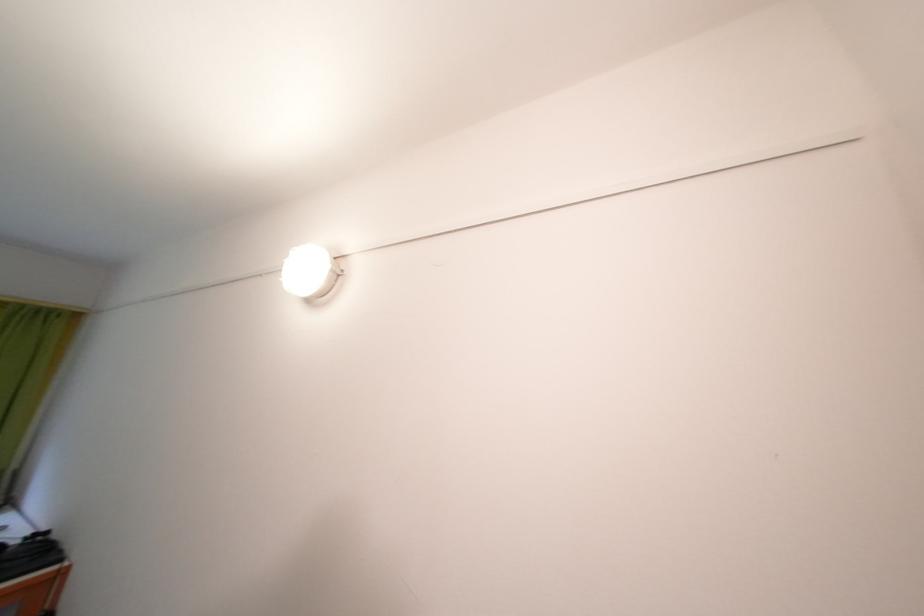
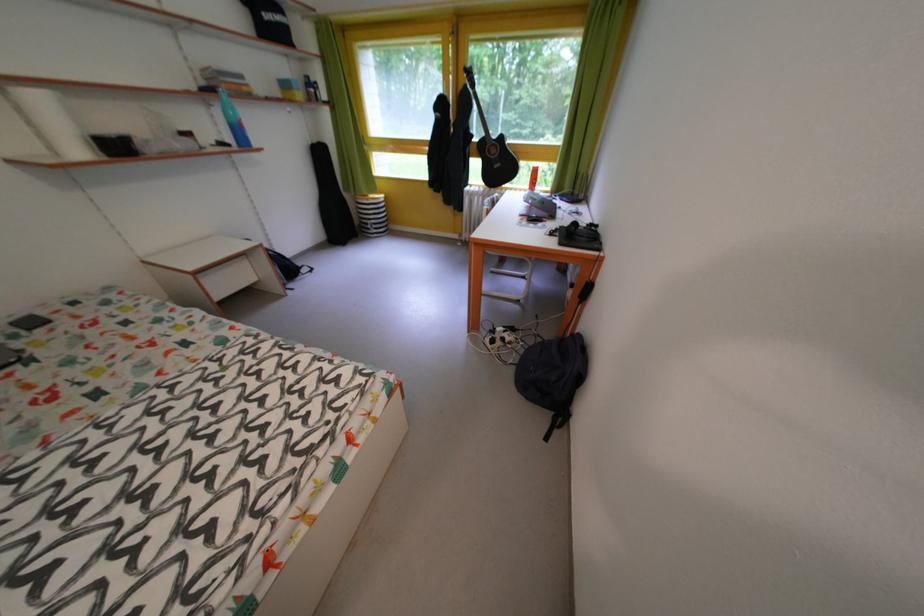
How did the camera likely rotate?

The rotation direction of the camera is left-down.